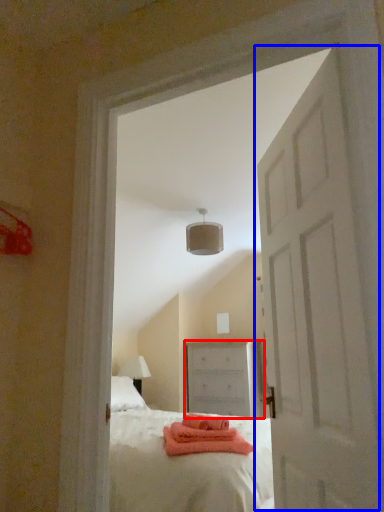
Question: Which of the following is the closest to the observer, chest of drawers (highlighted by a red box) or door (highlighted by a blue box)?

Choices:
 (A) chest of drawers
 (B) door

Answer: (B)